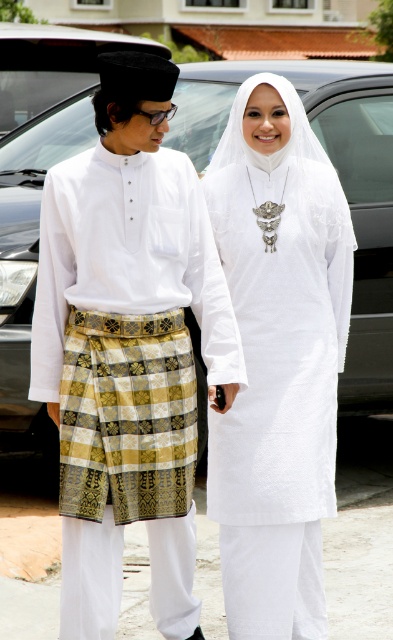
Question: Which object is closer to the camera taking this photo?

Choices:
 (A) metallic gray car at center
 (B) white matte dress at center
 (C) white woven kain at left

Answer: (C)

Question: Can you confirm if white matte dress at center is positioned to the right of metallic gray car at center?

Choices:
 (A) no
 (B) yes

Answer: (A)

Question: Can you confirm if white woven kain at left is positioned to the right of white matte dress at center?

Choices:
 (A) yes
 (B) no

Answer: (B)

Question: Among these points, which one is farthest from the camera?

Choices:
 (A) (159, 284)
 (B) (233, 81)

Answer: (B)

Question: Which of the following is the farthest from the observer?

Choices:
 (A) tap(49, 362)
 (B) tap(203, 118)
 (C) tap(240, 333)

Answer: (B)

Question: Does white matte dress at center appear over metallic gray car at center?

Choices:
 (A) yes
 (B) no

Answer: (B)